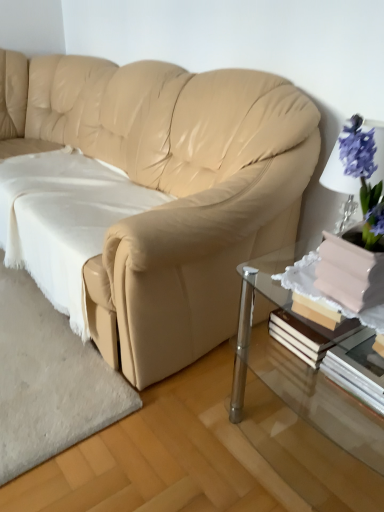
Question: From a real-world perspective, is white soft fabric at lower left positioned under white paper book at lower right based on gravity?

Choices:
 (A) no
 (B) yes

Answer: (B)

Question: Considering the relative sizes of white soft fabric at lower left and white paper book at lower right in the image provided, is white soft fabric at lower left shorter than white paper book at lower right?

Choices:
 (A) yes
 (B) no

Answer: (B)

Question: Is white soft fabric at lower left positioned in front of white paper book at lower right?

Choices:
 (A) yes
 (B) no

Answer: (B)

Question: Is white soft fabric at lower left with white paper book at lower right?

Choices:
 (A) no
 (B) yes

Answer: (A)

Question: From the image's perspective, would you say white soft fabric at lower left is positioned over white paper book at lower right?

Choices:
 (A) yes
 (B) no

Answer: (A)

Question: Considering the positions of white soft fabric at lower left and white paper book at lower right in the image, is white soft fabric at lower left bigger or smaller than white paper book at lower right?

Choices:
 (A) big
 (B) small

Answer: (A)

Question: Do you think white soft fabric at lower left is within white paper book at lower right, or outside of it?

Choices:
 (A) inside
 (B) outside

Answer: (B)

Question: From a real-world perspective, is white soft fabric at lower left physically located above or below white paper book at lower right?

Choices:
 (A) below
 (B) above

Answer: (A)

Question: Is point (157, 195) closer or farther from the camera than point (347, 386)?

Choices:
 (A) farther
 (B) closer

Answer: (A)

Question: Is clear glass table at lower right in front of or behind white paper book at lower right in the image?

Choices:
 (A) front
 (B) behind

Answer: (A)

Question: Visually, is clear glass table at lower right positioned to the left or to the right of white paper book at lower right?

Choices:
 (A) left
 (B) right

Answer: (A)

Question: From their relative heights in the image, would you say clear glass table at lower right is taller or shorter than white paper book at lower right?

Choices:
 (A) tall
 (B) short

Answer: (A)

Question: From a real-world perspective, relative to white paper book at lower right, is clear glass table at lower right vertically above or below?

Choices:
 (A) below
 (B) above

Answer: (A)

Question: Is white paper book at lower right wider or thinner than beige leather couch at center?

Choices:
 (A) wide
 (B) thin

Answer: (B)

Question: Is point (357, 387) positioned closer to the camera than point (211, 119)?

Choices:
 (A) closer
 (B) farther

Answer: (A)